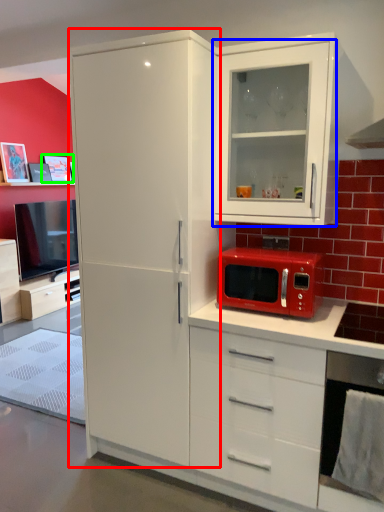
Question: Considering the real-world distances, which object is farthest from refrigerator (highlighted by a red box)? cabinetry (highlighted by a blue box) or picture frame (highlighted by a green box)?

Choices:
 (A) cabinetry
 (B) picture frame

Answer: (B)